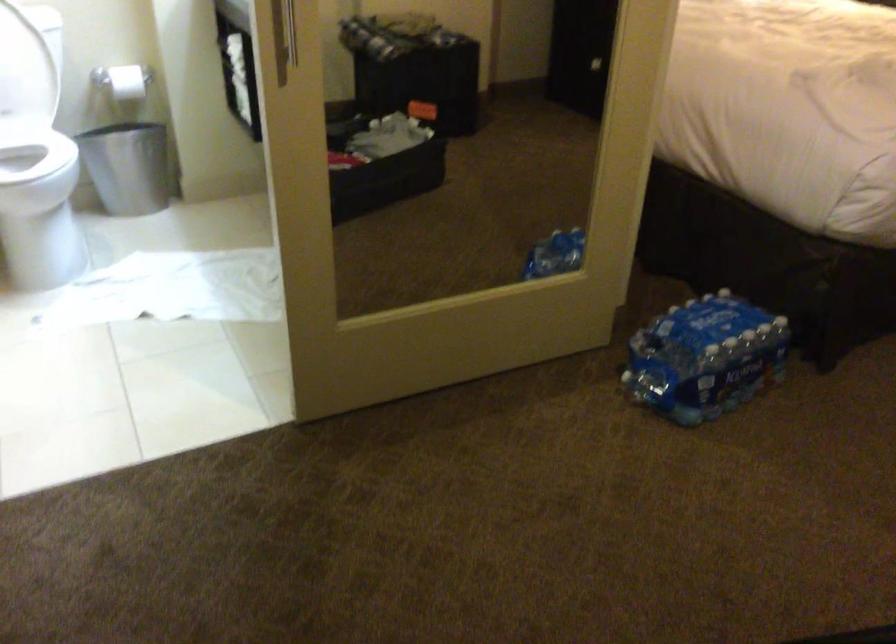
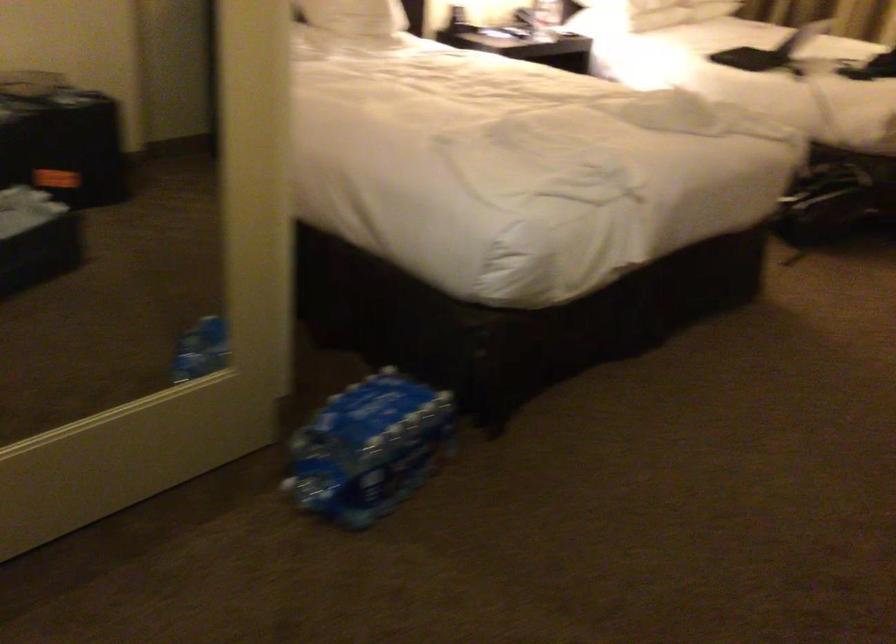
Question: Based on the continuous images, in which direction is the camera rotating? Reply with the corresponding letter.

Choices:
 (A) Left
 (B) Right
 (C) Up
 (D) Down

Answer: (B)